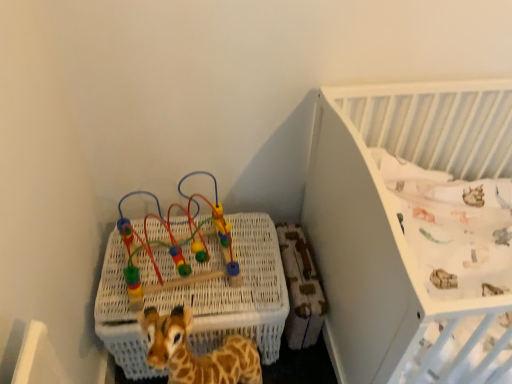
This screenshot has width=512, height=384. What do you see at coordinates (392, 212) in the screenshot? I see `white textured crib at upper right` at bounding box center [392, 212].

Locate an element on the screen. multicolored plastic bead maze at upper left is located at coordinates (177, 246).

Looking at this image, from a real-world perspective, is multicolored plastic bead maze at upper left on white wicker basket at lower left?

Indeed, from a real-world perspective, multicolored plastic bead maze at upper left stands above white wicker basket at lower left.

From the image's perspective, which one is positioned higher, multicolored plastic bead maze at upper left or white wicker basket at lower left?

From the image's view, multicolored plastic bead maze at upper left is above.

Is white wicker basket at lower left at the back of multicolored plastic bead maze at upper left?

No, multicolored plastic bead maze at upper left's orientation is not away from white wicker basket at lower left.

Who is smaller, multicolored plastic bead maze at upper left or white wicker basket at lower left?

With smaller size is multicolored plastic bead maze at upper left.

Consider the image. From a real-world perspective, is multicolored plastic bead maze at upper left under white textured crib at upper right?

No.

Looking at this image, is multicolored plastic bead maze at upper left spatially inside white textured crib at upper right, or outside of it?

multicolored plastic bead maze at upper left is outside white textured crib at upper right.

From their relative heights in the image, would you say multicolored plastic bead maze at upper left is taller or shorter than white textured crib at upper right?

Considering their sizes, multicolored plastic bead maze at upper left has less height than white textured crib at upper right.

From a real-world perspective, is white textured crib at upper right positioned over multicolored plastic bead maze at upper left based on gravity?

Actually, white textured crib at upper right is physically below multicolored plastic bead maze at upper left in the real world.

Consider the image. Does white textured crib at upper right turn towards multicolored plastic bead maze at upper left?

No, white textured crib at upper right is not oriented towards multicolored plastic bead maze at upper left.

Is white textured crib at upper right inside the boundaries of multicolored plastic bead maze at upper left, or outside?

white textured crib at upper right is outside multicolored plastic bead maze at upper left.

Between white textured crib at upper right and multicolored plastic bead maze at upper left, which one is positioned in front?

white textured crib at upper right is closer to the camera.

Which of these two, white wicker basket at lower left or white textured crib at upper right, is thinner?

white wicker basket at lower left.

This screenshot has height=384, width=512. I want to click on infant bed lying on the right of white wicker basket at lower left, so click(392, 212).

Considering the points (273, 244) and (439, 301), which point is in front, point (273, 244) or point (439, 301)?

The point (439, 301) is closer.

Which of these two, white wicker basket at lower left or white textured crib at upper right, is smaller?

With smaller size is white wicker basket at lower left.

Is point (366, 105) positioned in front of point (198, 329)?

No.

From the image's perspective, would you say white textured crib at upper right is shown under white wicker basket at lower left?

Incorrect, from the image's perspective, white textured crib at upper right is higher than white wicker basket at lower left.

Can you confirm if white textured crib at upper right is wider than white wicker basket at lower left?

Indeed, white textured crib at upper right has a greater width compared to white wicker basket at lower left.

Looking at this image, based on their positions, is white textured crib at upper right located to the left or right of white wicker basket at lower left?

Based on their positions, white textured crib at upper right is located to the right of white wicker basket at lower left.

How much distance is there between white wicker basket at lower left and multicolored plastic bead maze at upper left?

white wicker basket at lower left and multicolored plastic bead maze at upper left are 3.51 inches apart from each other.

What's the angular difference between white wicker basket at lower left and multicolored plastic bead maze at upper left's facing directions?

white wicker basket at lower left and multicolored plastic bead maze at upper left are facing 0.00022 degrees away from each other.

At what (x,y) coordinates should I click in order to perform the action: click on toy in front of the white wicker basket at lower left. Please return your answer as a coordinate pair (x, y). The width and height of the screenshot is (512, 384). Looking at the image, I should click on (177, 246).

In terms of size, does white wicker basket at lower left appear bigger or smaller than multicolored plastic bead maze at upper left?

Clearly, white wicker basket at lower left is larger in size than multicolored plastic bead maze at upper left.

Locate an element on the screen. The height and width of the screenshot is (384, 512). toy above the white wicker basket at lower left (from a real-world perspective) is located at coordinates (177, 246).

The image size is (512, 384). I want to click on infant bed on the right of multicolored plastic bead maze at upper left, so click(x=392, y=212).

Consider the image. When comparing their distances from white wicker basket at lower left, does multicolored plastic bead maze at upper left or white textured crib at upper right seem closer?

multicolored plastic bead maze at upper left lies closer to white wicker basket at lower left than the other object.

Based on their spatial positions, is multicolored plastic bead maze at upper left or white wicker basket at lower left closer to white textured crib at upper right?

white wicker basket at lower left.

Which object lies nearer to the anchor point white textured crib at upper right, white wicker basket at lower left or multicolored plastic bead maze at upper left?

white wicker basket at lower left is closer to white textured crib at upper right.

From the image, which object appears to be farther from multicolored plastic bead maze at upper left, white wicker basket at lower left or white textured crib at upper right?

white textured crib at upper right.

When comparing their distances from white wicker basket at lower left, does white textured crib at upper right or multicolored plastic bead maze at upper left seem closer?

Based on the image, multicolored plastic bead maze at upper left appears to be nearer to white wicker basket at lower left.

Considering their positions, is white textured crib at upper right positioned closer to multicolored plastic bead maze at upper left than white wicker basket at lower left?

white wicker basket at lower left.

Where is `crate located between multicolored plastic bead maze at upper left and white textured crib at upper right in the left-right direction`? crate located between multicolored plastic bead maze at upper left and white textured crib at upper right in the left-right direction is located at coordinates (238, 292).